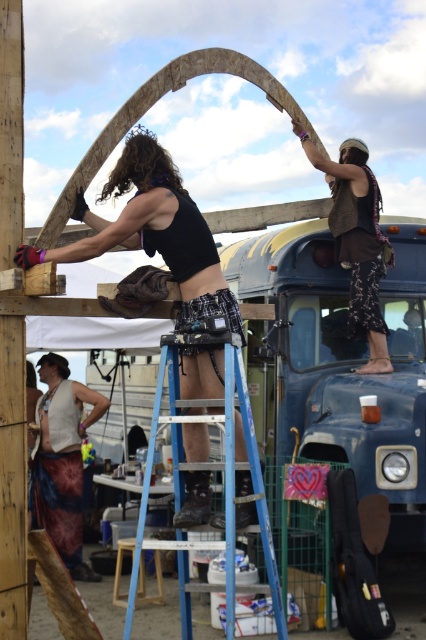
You are a photographer trying to capture the scene. You need to decide which object to focus on first based on their height. Which one is shorter between the matte black tank top at center and the blue metallic ladder at center?

The matte black tank top at center is shorter than the blue metallic ladder at center.